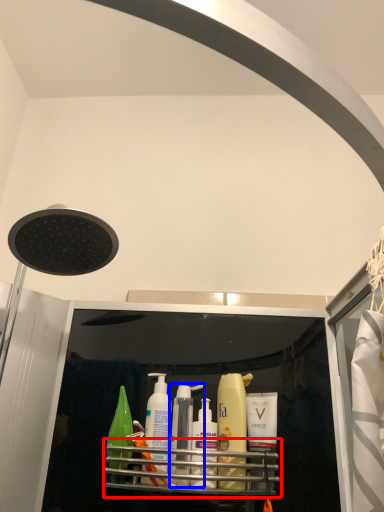
Question: Which of the following is the closest to the observer, shelf (highlighted by a red box) or toiletry (highlighted by a blue box)?

Choices:
 (A) shelf
 (B) toiletry

Answer: (A)